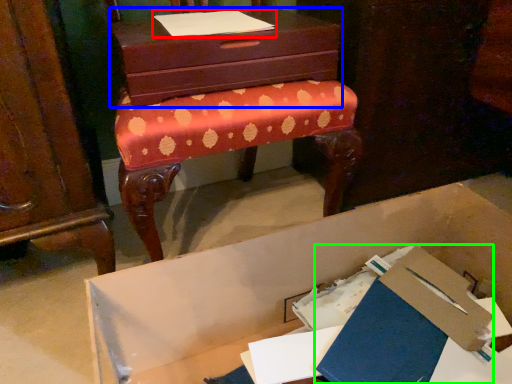
Question: Based on their relative distances, which object is farther from notebook (highlighted by a red box)? Choose from chest of drawers (highlighted by a blue box) and paperback book (highlighted by a green box).

Choices:
 (A) chest of drawers
 (B) paperback book

Answer: (B)